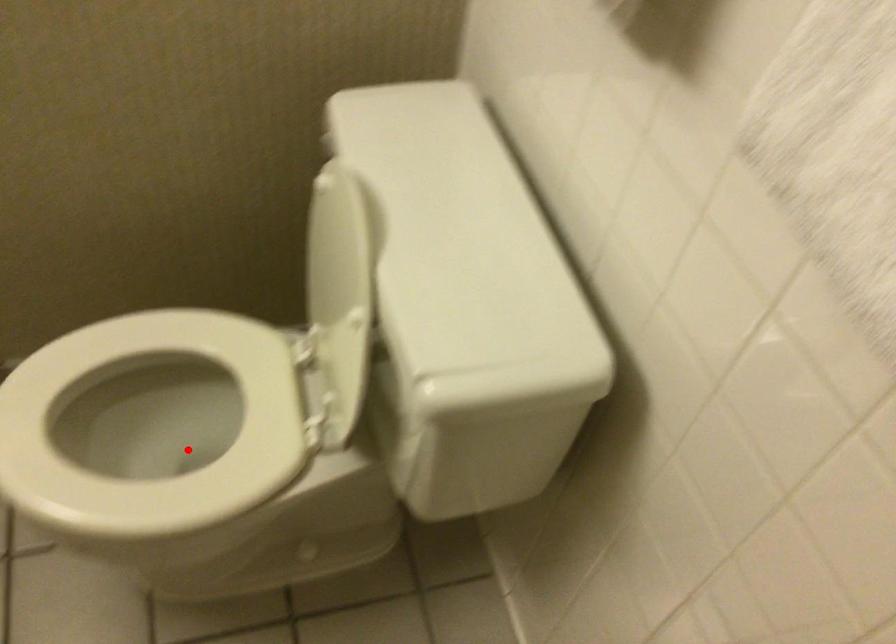
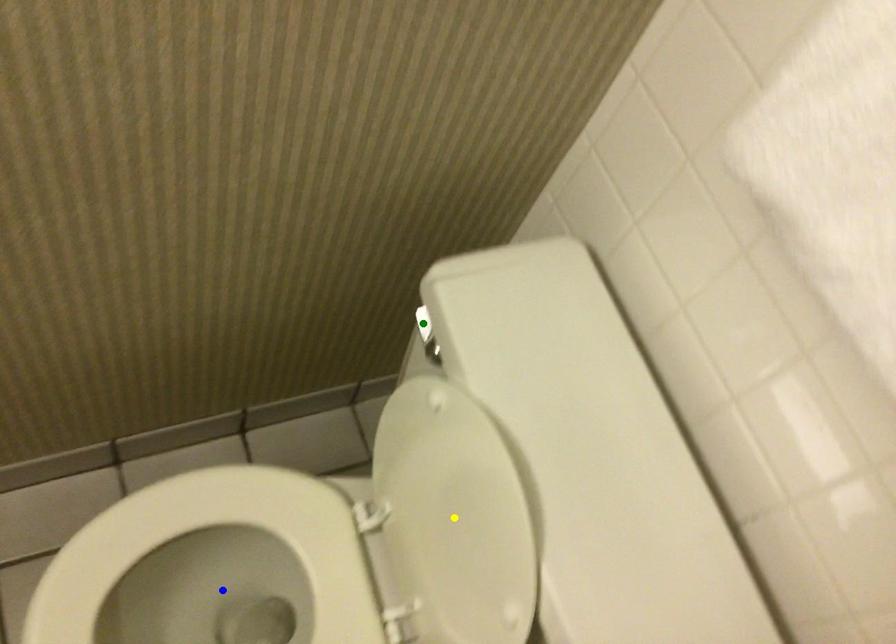
Question: I am providing you with two images of the same scene from different viewpoints. A red point is marked on the first image. You are given multiple points on the second image. Which mark in image 2 goes with the point in image 1?

Choices:
 (A) blue point
 (B) yellow point
 (C) green point

Answer: (A)